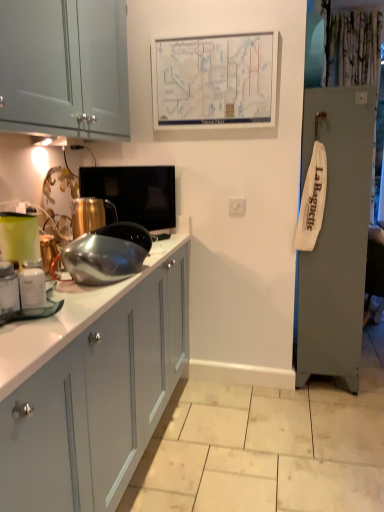
The width and height of the screenshot is (384, 512). I want to click on free space above matte black tv at center, arranged as the fourth appliance when viewed from the front (from a real-world perspective), so click(135, 167).